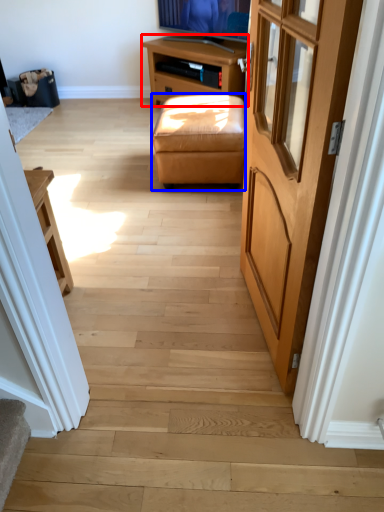
Question: Which point is closer to the camera, table (highlighted by a red box) or stool (highlighted by a blue box)?

Choices:
 (A) table
 (B) stool

Answer: (B)